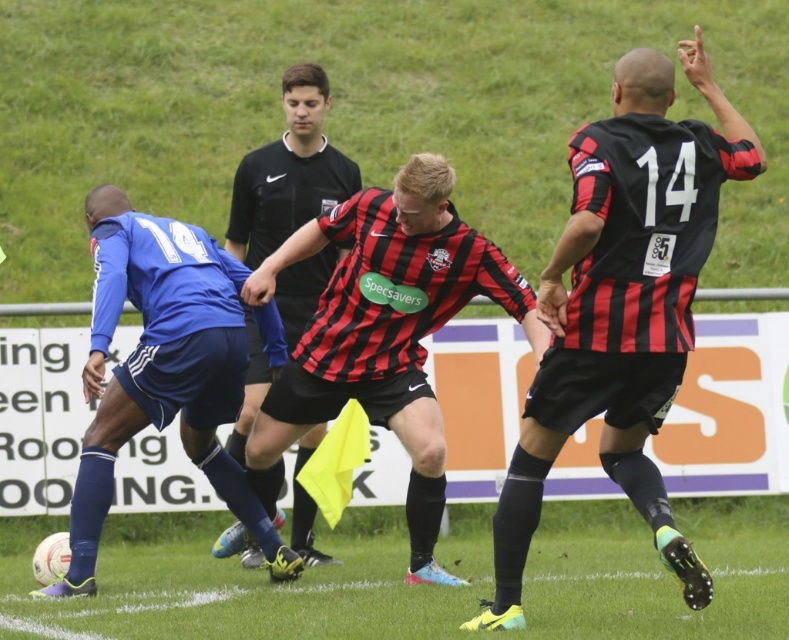
You are a soccer referee observing the game. You notice the blue fabric jersey at left and the black jersey at center. Which player is positioned closer to you?

The blue fabric jersey at left is closer to the viewer than the black jersey at center, so the player in the blue fabric jersey at left is positioned closer to you.

You are a soccer referee observing the game. You notice two points marked on the field at coordinates point (x=429, y=163) and point (x=125, y=403). Which point is closer to the soccer ball?

Point (x=429, y=163) is in front of point (x=125, y=403), so it is closer to the soccer ball.